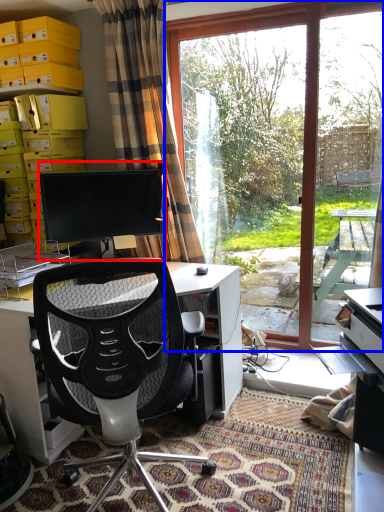
Question: Which of the following is the farthest to the observer, computer monitor (highlighted by a red box) or window (highlighted by a blue box)?

Choices:
 (A) computer monitor
 (B) window

Answer: (B)